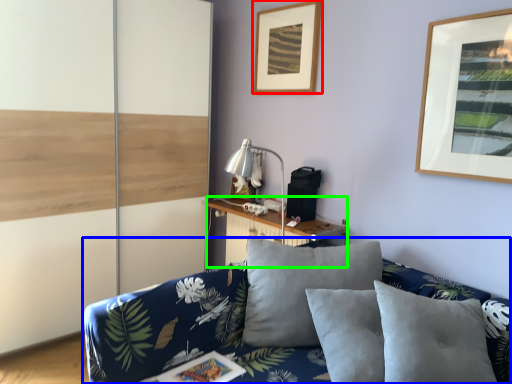
Question: Which object is the farthest from picture frame (highlighted by a red box)? Choose among these: studio couch (highlighted by a blue box) or table (highlighted by a green box).

Choices:
 (A) studio couch
 (B) table

Answer: (A)